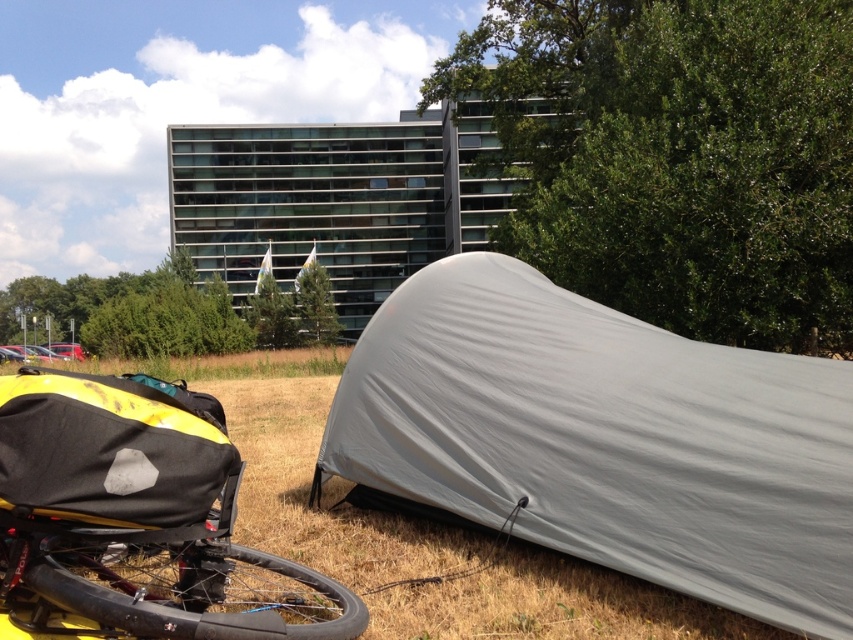
You are planning to set up a picnic area in the outdoor scene. Given the yellow matte bicycle at lower left and the green grass at lower center, which area would be more suitable for placing a picnic blanket?

The green grass at lower center is more suitable for placing a picnic blanket since it occupies more space than the yellow matte bicycle at lower left.

You are planning to set up a tent in this area. You see the gray fabric tent at lower right and the black rubber tire at lower left. Which object is closer to the ground?

The black rubber tire at lower left is closer to the ground because the gray fabric tent at lower right is positioned over it.

Based on the photo, you are a hiker who just arrived at the campsite. You see the green grass at lower center and the black rubber tire at lower left. Which object is located more to the left side of the campsite?

The green grass at lower center is positioned on the left side of black rubber tire at lower left, so the green grass at lower center is more to the left side of the campsite.